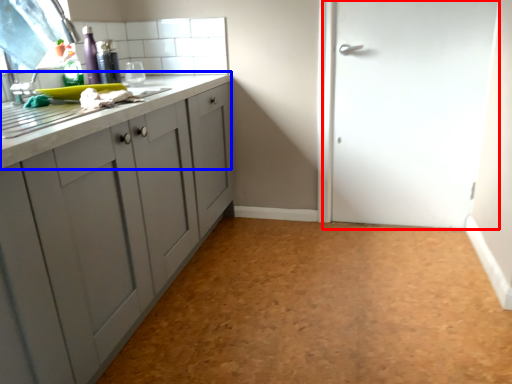
Question: Which of the following is the farthest to the observer, door (highlighted by a red box) or countertop (highlighted by a blue box)?

Choices:
 (A) door
 (B) countertop

Answer: (A)